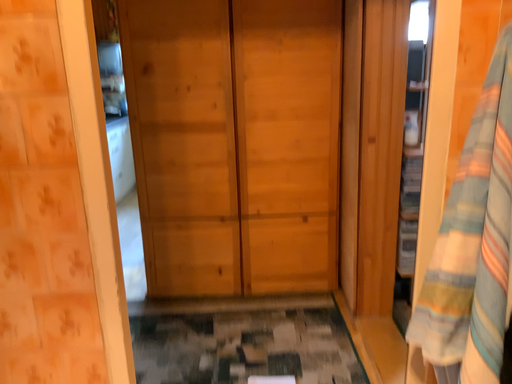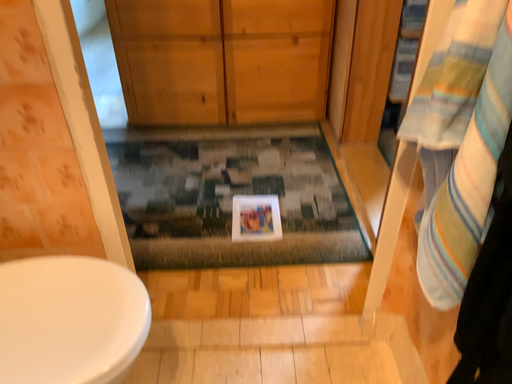
Question: Which way did the camera rotate in the video?

Choices:
 (A) rotated upward
 (B) rotated downward

Answer: (B)